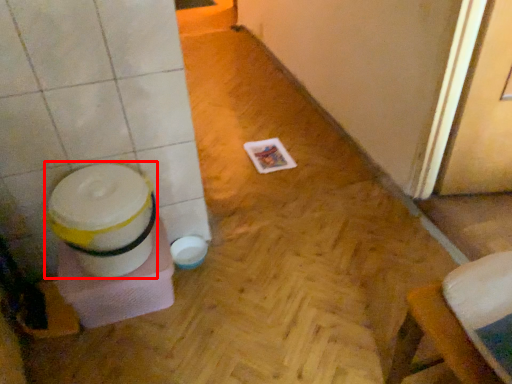
Question: From the image, what is the correct spatial relationship of potty (annotated by the red box) in relation to screen door?

Choices:
 (A) right
 (B) left

Answer: (B)